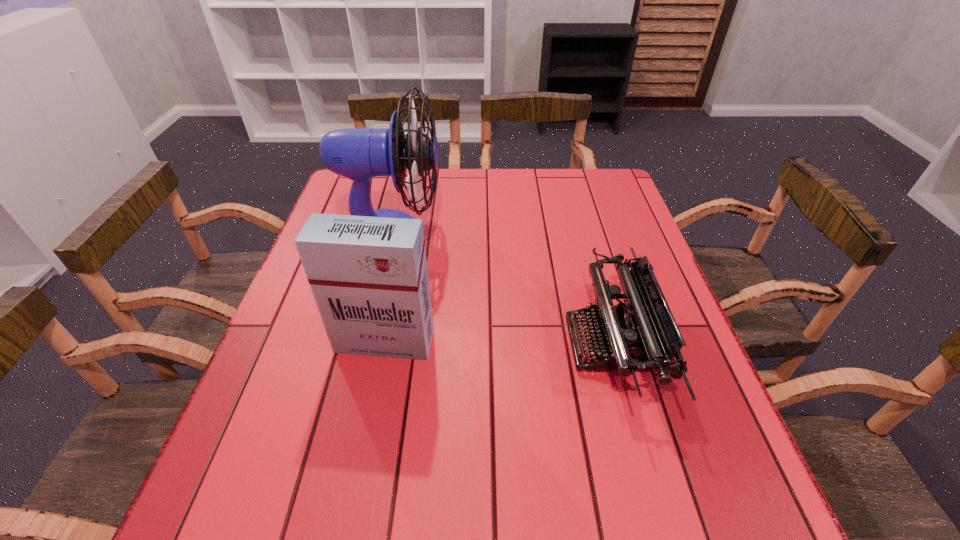
Where is `vacant space at the near right corner`? vacant space at the near right corner is located at coordinates (714, 516).

Locate an element on the screen. The height and width of the screenshot is (540, 960). unoccupied position between the rightmost object and the second shortest object is located at coordinates (498, 342).

This screenshot has height=540, width=960. In order to click on free space between the cigarette case and the rightmost object in this screenshot , I will do `click(498, 342)`.

Find the location of `empty location between the typewriter and the second tallest object`. empty location between the typewriter and the second tallest object is located at coordinates (498, 342).

I want to click on vacant point located between the farthest object and the rightmost object, so 501,288.

Where is `free space between the cigarette case and the rightmost object`? The width and height of the screenshot is (960, 540). free space between the cigarette case and the rightmost object is located at coordinates (498, 342).

At what (x,y) coordinates should I click in order to perform the action: click on free space between the tallest object and the shortest object. Please return your answer as a coordinate pair (x, y). Image resolution: width=960 pixels, height=540 pixels. Looking at the image, I should click on (501, 288).

Locate an element on the screen. This screenshot has height=540, width=960. vacant region between the cigarette case and the typewriter is located at coordinates (498, 342).

Identify the location of free area in between the typewriter and the cigarette case. The height and width of the screenshot is (540, 960). (498, 342).

Where is `vacant area that lies between the fan and the typewriter`? vacant area that lies between the fan and the typewriter is located at coordinates (501, 288).